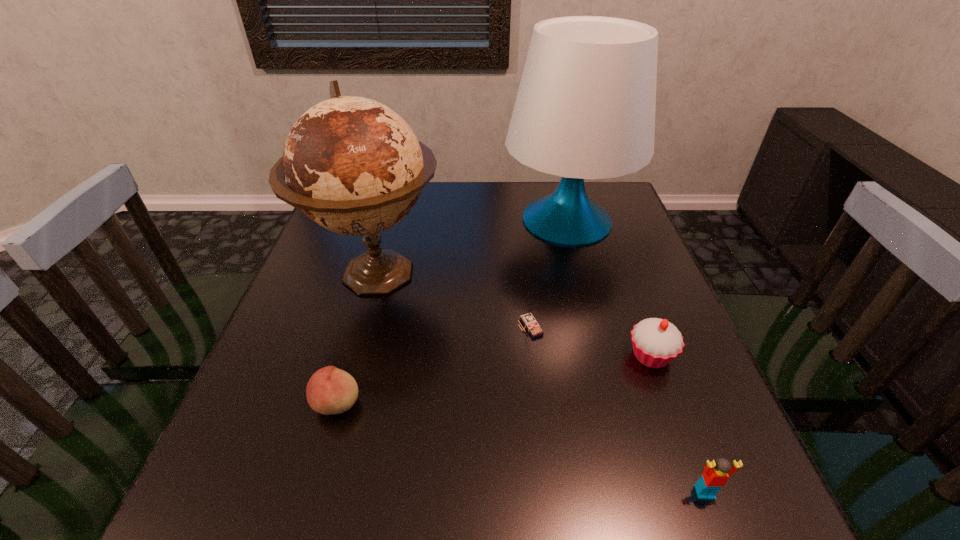
I want to click on free space located 0.270m on the front of the globe showing Asia, so click(x=331, y=438).

Locate an element on the screen. The image size is (960, 540). blank space located on the front of the matchbox is located at coordinates (546, 464).

The image size is (960, 540). Identify the location of vacant space located on the back of the cupcake. [631, 301].

I want to click on vacant region located on the face of the Lego, so click(x=721, y=535).

Identify the location of vacant point located on the back of the second nearest object. (369, 291).

At what (x,y) coordinates should I click in order to perform the action: click on object that is at the far edge. Please return your answer as a coordinate pair (x, y). The image size is (960, 540). Looking at the image, I should click on (585, 109).

The image size is (960, 540). Find the location of `object present at the near edge`. object present at the near edge is located at coordinates (716, 473).

The width and height of the screenshot is (960, 540). In order to click on globe present at the left edge in this screenshot , I will do `click(354, 166)`.

Where is `peach present at the left edge`? peach present at the left edge is located at coordinates (330, 390).

Find the location of `table lamp that is at the right edge`. table lamp that is at the right edge is located at coordinates (585, 109).